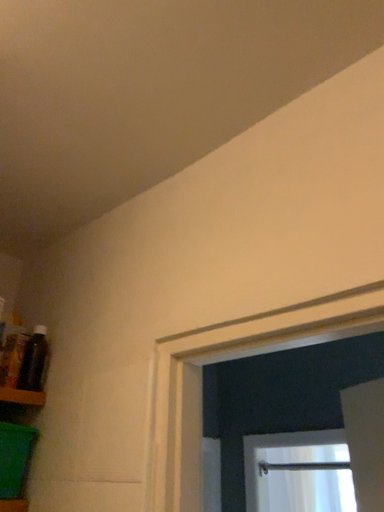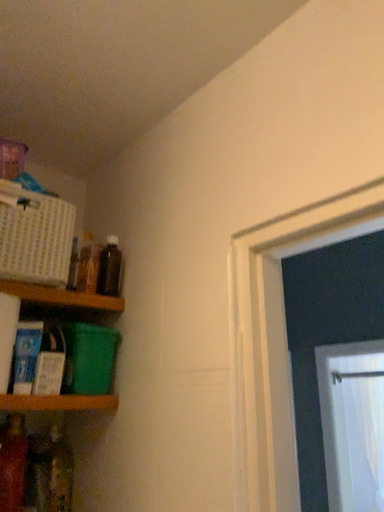
Question: How did the camera likely rotate when shooting the video?

Choices:
 (A) rotated downward
 (B) rotated upward

Answer: (A)